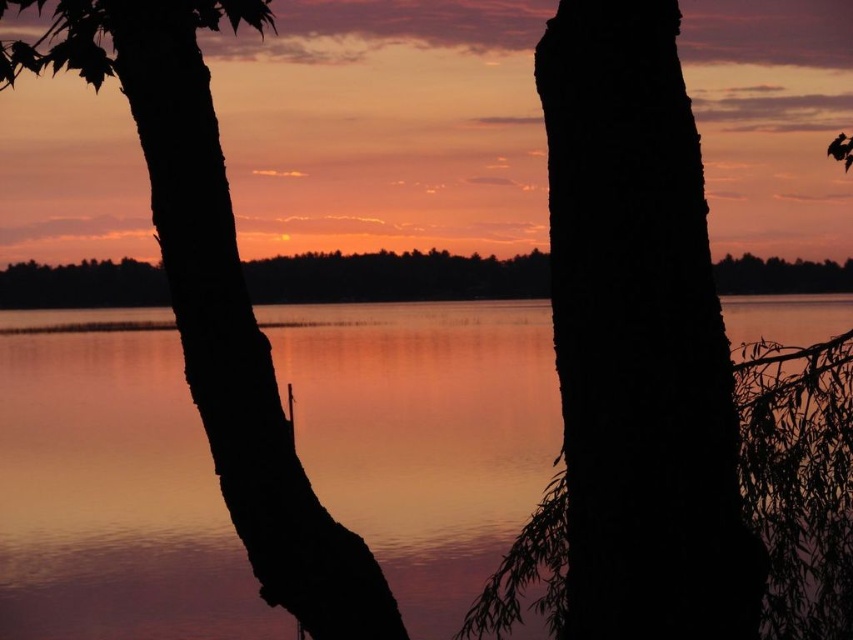
Who is lower down, black rough bark at center or black matte tree trunk at left?

Answer: black rough bark at center is lower down.

Between black rough bark at center and black matte tree trunk at left, which one appears on the right side from the viewer's perspective?

Positioned to the right is black rough bark at center.

Is point (651, 24) behind point (280, 556)?

No, (651, 24) is in front of (280, 556).

This screenshot has width=853, height=640. What are the coordinates of `black rough bark at center` in the screenshot? It's located at (639, 339).

Does smooth water at center have a larger size compared to black matte tree trunk at left?

Indeed, smooth water at center has a larger size compared to black matte tree trunk at left.

Is smooth water at center to the left of black matte tree trunk at left from the viewer's perspective?

No, smooth water at center is not to the left of black matte tree trunk at left.

Is point (480, 378) less distant than point (274, 582)?

No, (480, 378) is further to viewer.

This screenshot has width=853, height=640. I want to click on smooth water at center, so click(111, 490).

Is point (424, 342) closer to camera compared to point (595, 525)?

No, it is not.

Image resolution: width=853 pixels, height=640 pixels. Identify the location of smooth water at center. (111, 490).